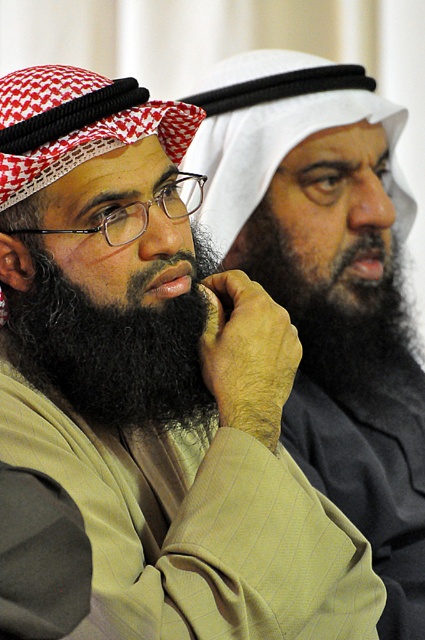
Does blackwoollybeard at left appear over black fuzzy beard at center?

No.

Does blackwoollybeard at left have a lesser width compared to black fuzzy beard at center?

Correct, blackwoollybeard at left's width is less than black fuzzy beard at center's.

The width and height of the screenshot is (425, 640). I want to click on blackwoollybeard at left, so click(110, 348).

Where is `blackwoollybeard at left`? The width and height of the screenshot is (425, 640). blackwoollybeard at left is located at coordinates (110, 348).

Does matte black beard at center appear on the right side of black fuzzy beard at center?

No, matte black beard at center is not to the right of black fuzzy beard at center.

Is point (316, 216) positioned after point (289, 304)?

Yes, it is behind point (289, 304).

This screenshot has height=640, width=425. Describe the element at coordinates (329, 289) in the screenshot. I see `matte black beard at center` at that location.

I want to click on matte black beard at center, so click(x=329, y=289).

Between point (248, 97) and point (164, 410), which one is positioned in front?

Point (164, 410) is more forward.

Can you confirm if matte black beard at center is taller than blackwoollybeard at left?

Indeed, matte black beard at center has a greater height compared to blackwoollybeard at left.

Does point (252, 68) lie behind point (146, 326)?

Yes.

The height and width of the screenshot is (640, 425). In order to click on matte black beard at center in this screenshot , I will do `click(329, 289)`.